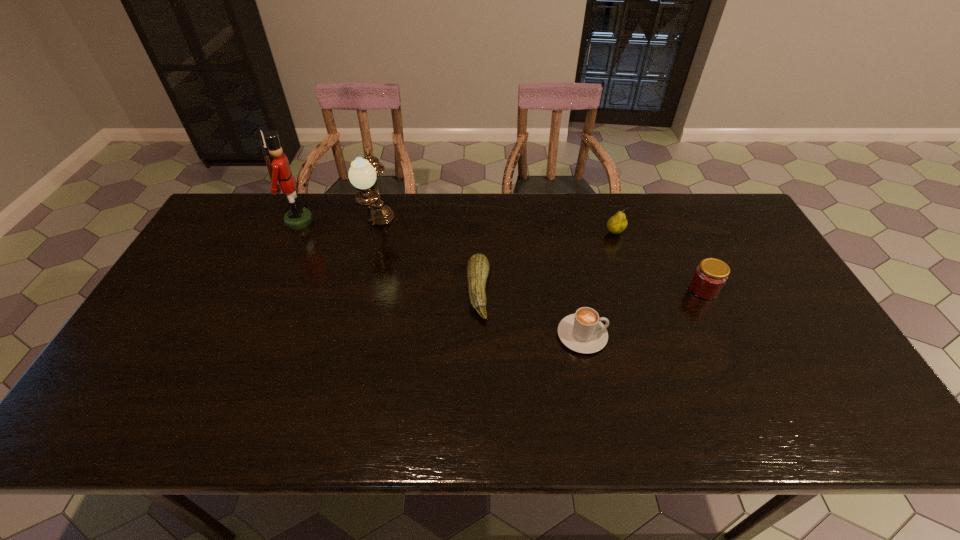
Identify the location of free space between the third object from right to left and the pear. (599, 284).

What are the coordinates of `free spot between the leftmost object and the fifth object from right to left` in the screenshot? It's located at (339, 224).

Identify the location of free spot between the shortest object and the cappuccino. (530, 313).

Identify which object is the fourth nearest to the pear. Please provide its 2D coordinates. Your answer should be formatted as a tuple, i.e. [(x, y)], where the tuple contains the x and y coordinates of a point satisfying the conditions above.

[(362, 174)]

Identify which object is the nearest to the nutcracker. Please provide its 2D coordinates. Your answer should be formatted as a tuple, i.e. [(x, y)], where the tuple contains the x and y coordinates of a point satisfying the conditions above.

[(362, 174)]

Identify the location of free spot that satisfies the following two spatial constraints: 1. on the front side of the second object from right to left; 2. to the right of the cappuccino. (649, 335).

The image size is (960, 540). I want to click on free space in the image that satisfies the following two spatial constraints: 1. on the front-facing side of the leftmost object; 2. on the back side of the oil lamp, so click(x=298, y=226).

The image size is (960, 540). I want to click on vacant point that satisfies the following two spatial constraints: 1. on the front-facing side of the leftmost object; 2. on the left side of the jam, so click(x=269, y=289).

Locate an element on the screen. This screenshot has height=540, width=960. vacant space that satisfies the following two spatial constraints: 1. on the front-facing side of the fifth object from left to right; 2. on the left side of the tallest object is located at coordinates (294, 233).

Find the location of a particular element. This screenshot has height=540, width=960. free space in the image that satisfies the following two spatial constraints: 1. on the front side of the rightmost object; 2. on the left side of the pear is located at coordinates point(634,289).